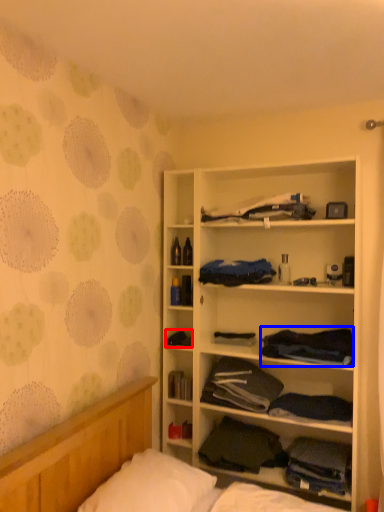
Question: Which point is further to the camera, clothing (highlighted by a red box) or clothing (highlighted by a blue box)?

Choices:
 (A) clothing
 (B) clothing

Answer: (A)